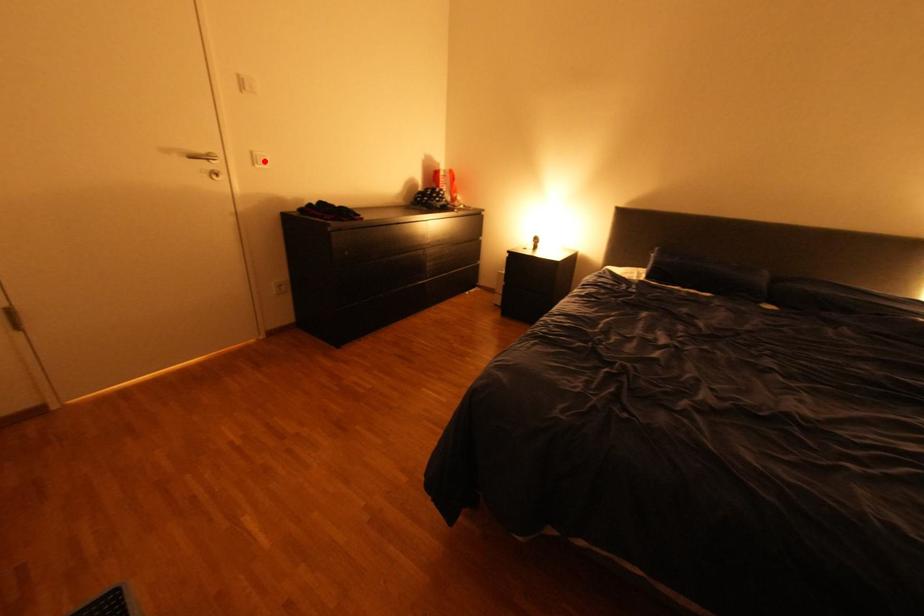
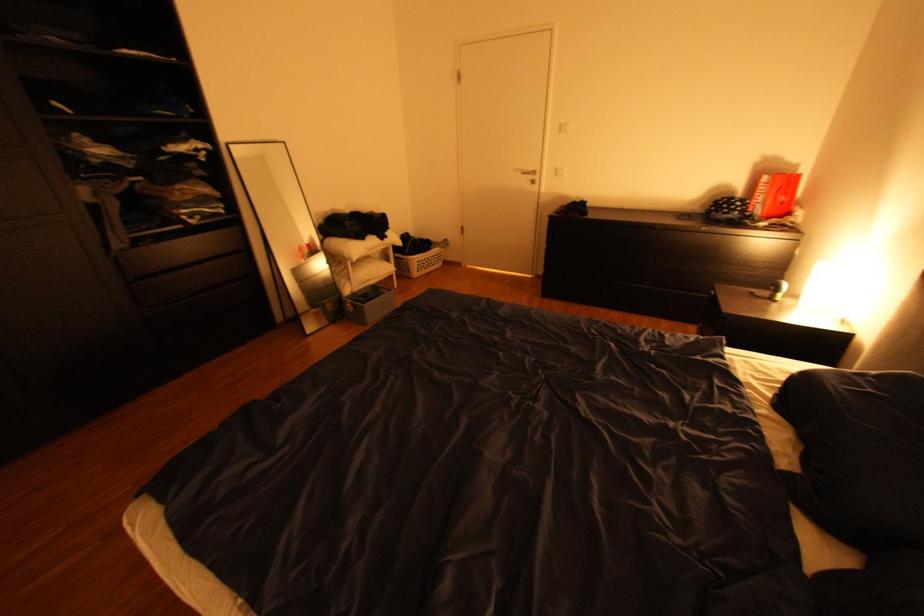
Where in the second image is the point corresponding to the highlighted location from the first image?

(565, 174)